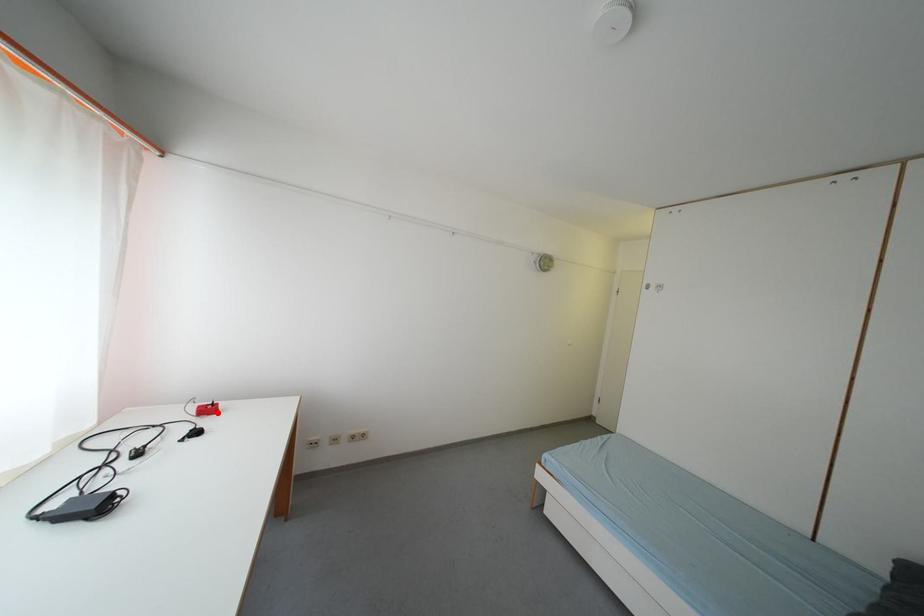
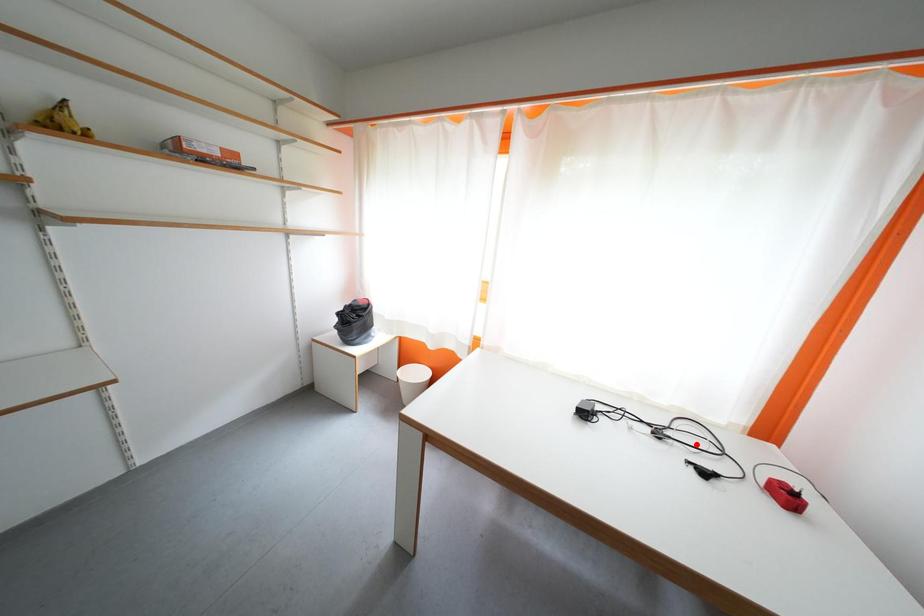
I am providing you with two images of the same scene from different viewpoints. A red point is marked on the first image and another point is marked on the second image. Is the marked point in image1 the same physical position as the marked point in image2?

No